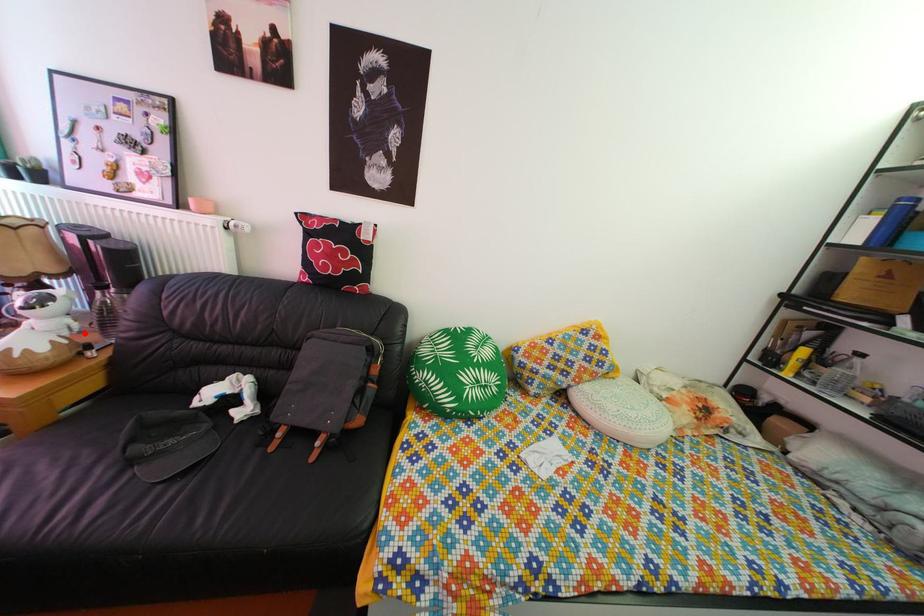
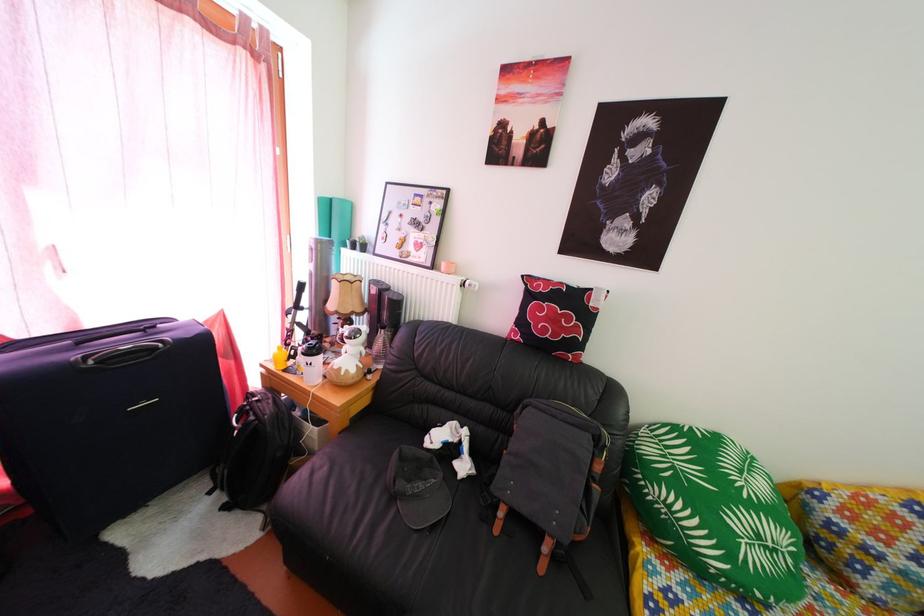
Question: I am providing you with two images of the same scene from different viewpoints. A red point is shown in image1. For the corresponding object point in image2, is it positioned nearer or farther from the camera?

Choices:
 (A) Nearer
 (B) Farther

Answer: (B)